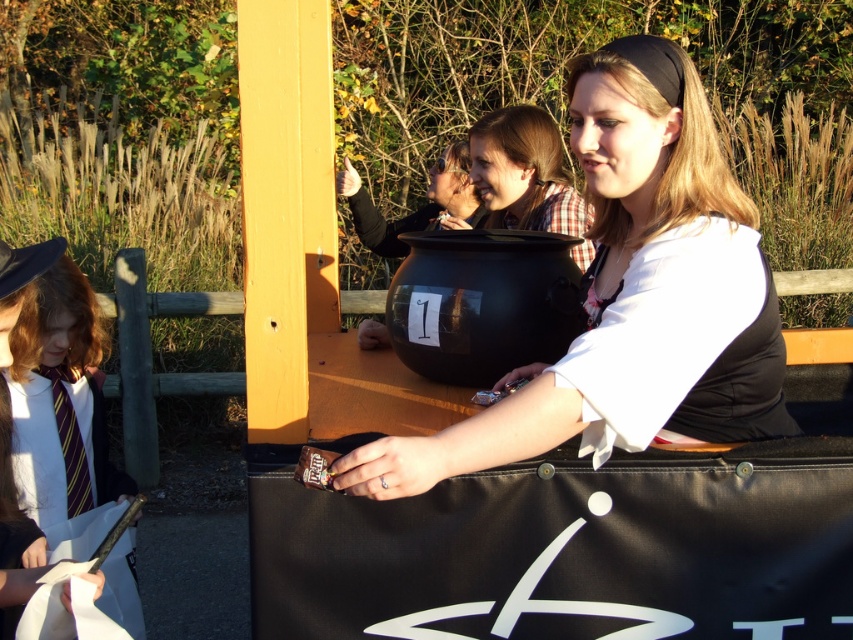
You are standing in front of the large black cauldron labeled 1. You see two points in the scene, point [659,285] and point [20,410]. Which point is closer to you?

Point [659,285] is closer to you than point [20,410].

You are organizing a Halloween party and need to arrange decorations. The matte black cauldron at center and the white shirt with tie at left are part of the setup. Based on their positions, which object is higher up?

The matte black cauldron at center is located above the white shirt with tie at left, so it is higher up.

You are organizing a Halloween party and need to place a small chocolate into the matte black cauldron at center. Considering the size of the white shirt with tie at left, will the chocolate fit inside the cauldron?

The matte black cauldron at center is larger in size than the white shirt with tie at left. Since the chocolate is smaller than the shirt, it should easily fit inside the cauldron.